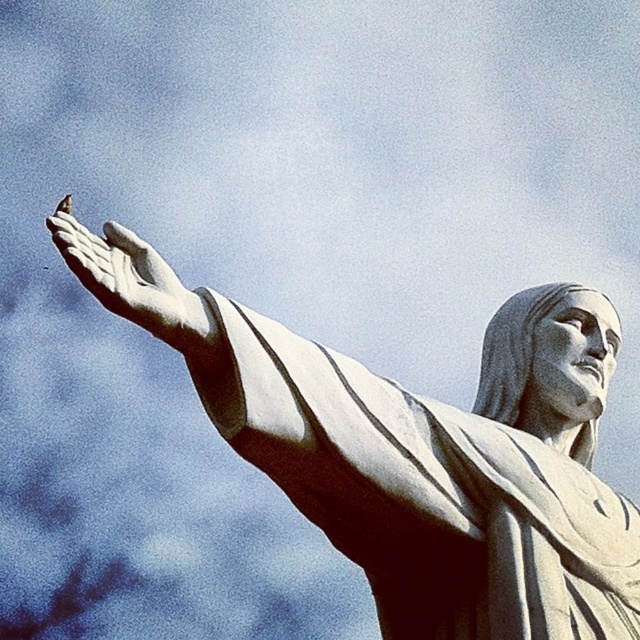
Question: Which of the following is the closest to the observer?

Choices:
 (A) (298, 348)
 (B) (196, 340)

Answer: (B)

Question: Does white marble statue at center lie in front of white marble hand at center?

Choices:
 (A) no
 (B) yes

Answer: (A)

Question: From the image, what is the correct spatial relationship of white marble statue at center in relation to white marble hand at center?

Choices:
 (A) above
 (B) below

Answer: (B)

Question: Which point is farther to the camera?

Choices:
 (A) (328, 410)
 (B) (64, 236)

Answer: (A)

Question: Where is white marble statue at center located in relation to white marble hand at center in the image?

Choices:
 (A) right
 (B) left

Answer: (A)